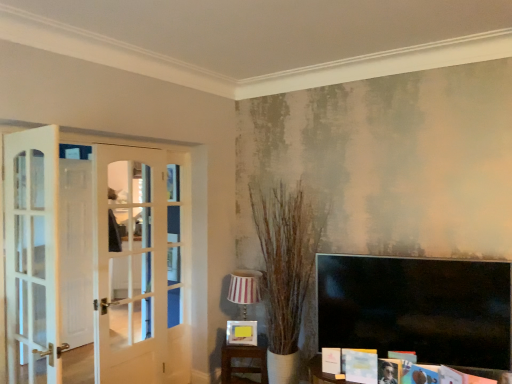
Question: Can you confirm if wooden table at lower center is smaller than striped fabric lampshade at center?

Choices:
 (A) yes
 (B) no

Answer: (A)

Question: Does wooden table at lower center have a greater width compared to striped fabric lampshade at center?

Choices:
 (A) no
 (B) yes

Answer: (B)

Question: From the image's perspective, is wooden table at lower center beneath striped fabric lampshade at center?

Choices:
 (A) no
 (B) yes

Answer: (B)

Question: From a real-world perspective, is wooden table at lower center on top of striped fabric lampshade at center?

Choices:
 (A) no
 (B) yes

Answer: (A)

Question: Would you say wooden table at lower center contains striped fabric lampshade at center?

Choices:
 (A) no
 (B) yes

Answer: (A)

Question: From the image's perspective, is striped fabric lampshade at center above or below wooden table at lower center?

Choices:
 (A) below
 (B) above

Answer: (B)

Question: Considering the positions of point (240, 314) and point (266, 365), is point (240, 314) closer or farther from the camera than point (266, 365)?

Choices:
 (A) closer
 (B) farther

Answer: (B)

Question: From a real-world perspective, is striped fabric lampshade at center above or below wooden table at lower center?

Choices:
 (A) below
 (B) above

Answer: (B)

Question: Would you say striped fabric lampshade at center is to the left or to the right of wooden table at lower center in the picture?

Choices:
 (A) right
 (B) left

Answer: (B)

Question: From a real-world perspective, is matte white magazine at lower right positioned above or below striped fabric lampshade at center?

Choices:
 (A) below
 (B) above

Answer: (A)

Question: In terms of height, does matte white magazine at lower right look taller or shorter compared to striped fabric lampshade at center?

Choices:
 (A) tall
 (B) short

Answer: (B)

Question: Is matte white magazine at lower right spatially inside striped fabric lampshade at center, or outside of it?

Choices:
 (A) outside
 (B) inside

Answer: (A)

Question: Based on their sizes in the image, would you say matte white magazine at lower right is bigger or smaller than striped fabric lampshade at center?

Choices:
 (A) small
 (B) big

Answer: (A)

Question: From their relative heights in the image, would you say matte white magazine at lower right is taller or shorter than wooden table at lower center?

Choices:
 (A) tall
 (B) short

Answer: (B)

Question: Choose the correct answer: Is matte white magazine at lower right inside wooden table at lower center or outside it?

Choices:
 (A) outside
 (B) inside

Answer: (A)